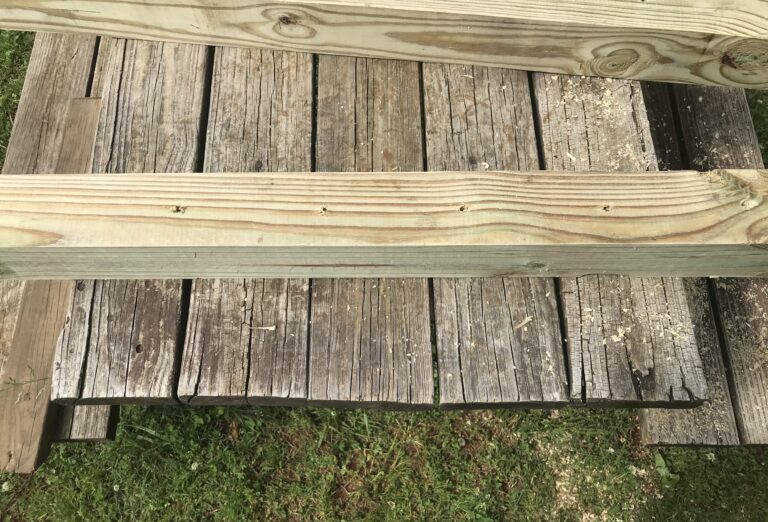
Identify the location of loose wood board. (44, 347).